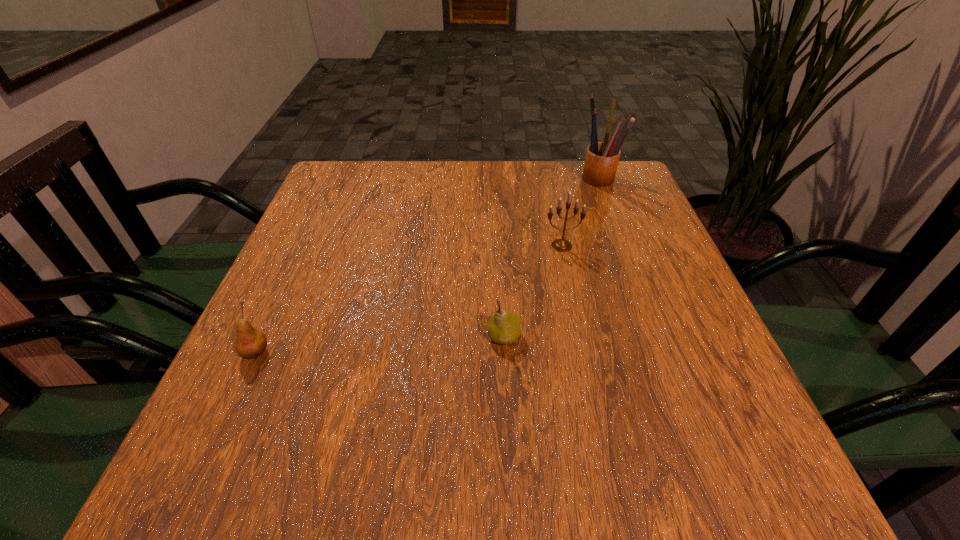
The height and width of the screenshot is (540, 960). Identify the location of vacant space at the near right corner of the desktop. 751,457.

Find the location of `free space that is in between the right pear and the farthest object`. free space that is in between the right pear and the farthest object is located at coordinates (551, 258).

This screenshot has height=540, width=960. I want to click on free space between the candelabrum and the tallest object, so click(580, 212).

Where is `free space between the right pear and the pencil box`? This screenshot has width=960, height=540. free space between the right pear and the pencil box is located at coordinates (551, 258).

Image resolution: width=960 pixels, height=540 pixels. I want to click on unoccupied position between the left pear and the pencil box, so click(427, 266).

The image size is (960, 540). I want to click on empty space that is in between the left pear and the rightmost object, so click(x=427, y=266).

Locate an element on the screen. This screenshot has width=960, height=540. free spot between the left pear and the right pear is located at coordinates (380, 345).

Where is `empty space that is in between the left pear and the third nearest object`? The height and width of the screenshot is (540, 960). empty space that is in between the left pear and the third nearest object is located at coordinates (409, 299).

At what (x,y) coordinates should I click in order to perform the action: click on free space between the farthest object and the left pear. Please return your answer as a coordinate pair (x, y). Looking at the image, I should click on (427, 266).

Where is `blank region between the right pear and the tallest object`? Image resolution: width=960 pixels, height=540 pixels. blank region between the right pear and the tallest object is located at coordinates (551, 258).